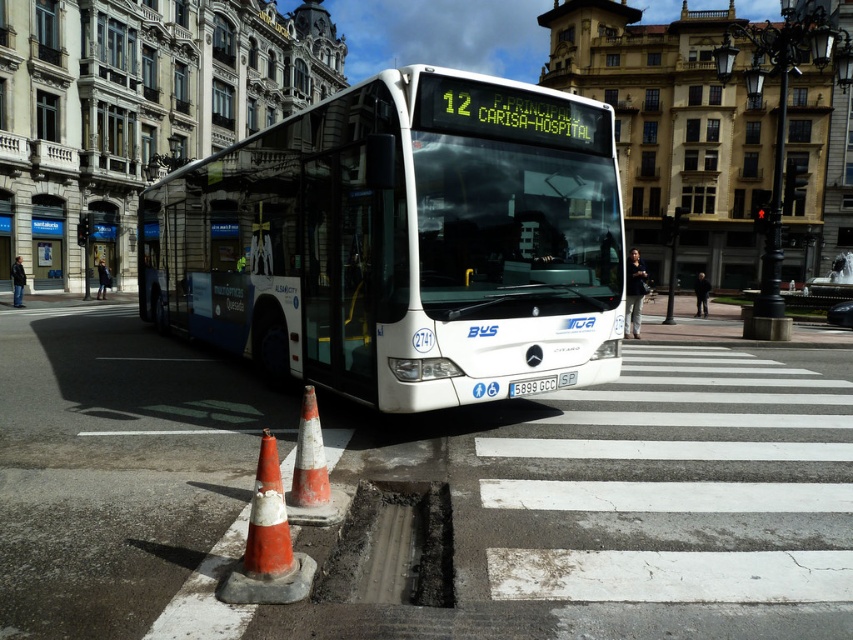
This screenshot has height=640, width=853. I want to click on orange/white striped cone at lower center, so click(311, 472).

Where is `orange/white striped cone at lower center`? Image resolution: width=853 pixels, height=640 pixels. orange/white striped cone at lower center is located at coordinates [x=311, y=472].

Which of these two, white glossy bus at center or metallic glass bus stop at left, stands shorter?

white glossy bus at center

Can you confirm if white glossy bus at center is taller than metallic glass bus stop at left?

Incorrect, white glossy bus at center's height is not larger of metallic glass bus stop at left's.

Identify the location of white glossy bus at center. (401, 243).

Which is below, white glossy bus at center or orange/white striped cone at lower center?

Positioned lower is orange/white striped cone at lower center.

Can you confirm if white glossy bus at center is taller than orange/white striped cone at lower center?

Indeed, white glossy bus at center has a greater height compared to orange/white striped cone at lower center.

Is point (367, 337) positioned after point (335, 497)?

Yes, point (367, 337) is farther from viewer.

At what (x,y) coordinates should I click in order to perform the action: click on white glossy bus at center. Please return your answer as a coordinate pair (x, y). Looking at the image, I should click on (401, 243).